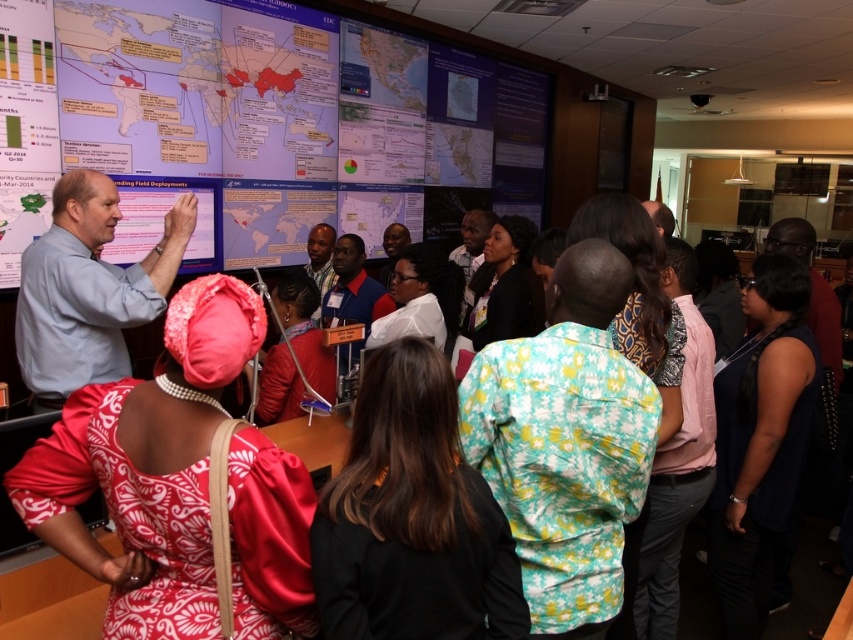
Question: Is matte white board at upper left to the left of silky red dress at center from the viewer's perspective?

Choices:
 (A) yes
 (B) no

Answer: (B)

Question: Is matte white board at upper left bigger than silky red dress at center?

Choices:
 (A) no
 (B) yes

Answer: (B)

Question: Is matte white board at upper left to the left of silky red dress at center from the viewer's perspective?

Choices:
 (A) yes
 (B) no

Answer: (B)

Question: Among these objects, which one is farthest from the camera?

Choices:
 (A) silky red dress at center
 (B) matte white board at upper left

Answer: (B)

Question: Among these points, which one is nearest to the camera?

Choices:
 (A) (396, 161)
 (B) (268, 598)

Answer: (B)

Question: Which point is farther to the camera?

Choices:
 (A) matte white board at upper left
 (B) silky red dress at center

Answer: (A)